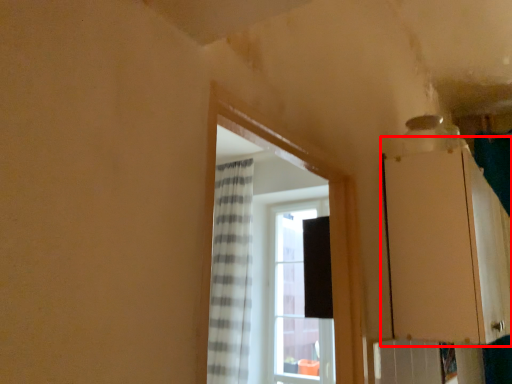
Question: Observing the image, what is the correct spatial positioning of cabinetry (annotated by the red box) in reference to window?

Choices:
 (A) left
 (B) right

Answer: (B)